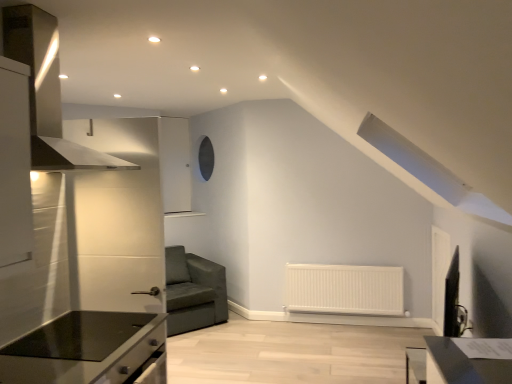
Locate an element on the screen. free point below stainless steel exhaust hood at left (from a real-world perspective) is located at coordinates (51, 338).